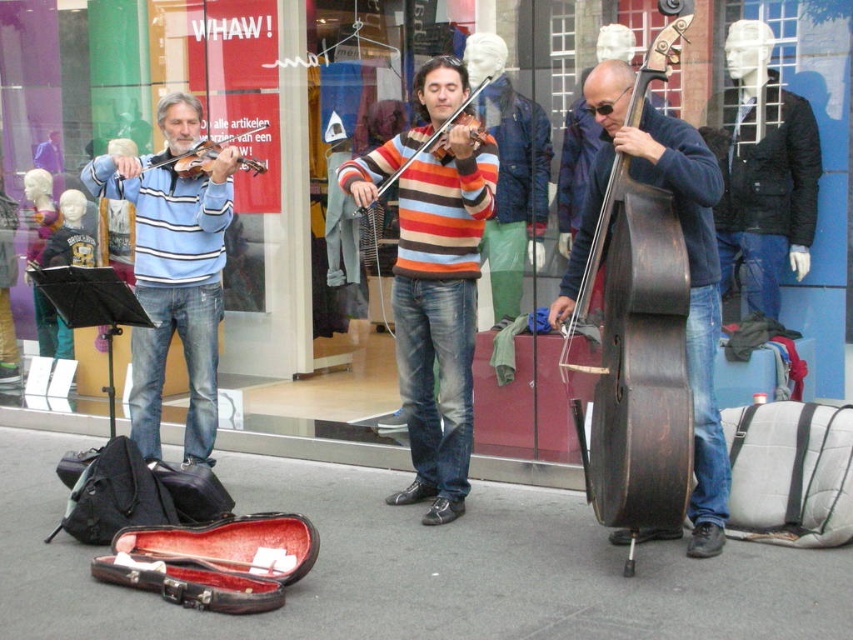
You are standing in front of the street performance scene. There are two points marked in the image. The first point is at coordinates point (112, 172) and the second point is at point (215, 154). Which of these two points is nearer to you?

Point (112, 172) is closer to the viewer than point (215, 154).

You are a street performer who just arrived at the scene. You see the matte black violin at left and the wooden violin at center. Which one is positioned more to the left?

The matte black violin at left is positioned more to the left than the wooden violin at center.